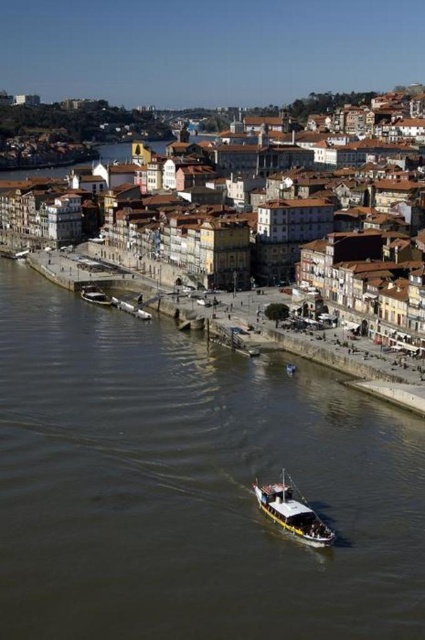
Question: Can you confirm if brown textured buildings at center is bigger than metallic silver boat at lower left?

Choices:
 (A) no
 (B) yes

Answer: (B)

Question: Does brown textured buildings at center have a smaller size compared to white matte boat at center?

Choices:
 (A) yes
 (B) no

Answer: (B)

Question: Among these points, which one is nearest to the camera?

Choices:
 (A) 314,525
 (B) 235,420
 (C) 87,294
 (D) 297,262

Answer: (A)

Question: Estimate the real-world distances between objects in this image. Which object is farther from the brown water at center?

Choices:
 (A) brown textured buildings at center
 (B) metallic silver boat at lower left

Answer: (A)

Question: Which point is farther to the camera?

Choices:
 (A) brown textured buildings at center
 (B) metallic silver boat at lower left
 (C) brown water at center

Answer: (B)

Question: Does brown textured buildings at center appear under white matte boat at center?

Choices:
 (A) yes
 (B) no

Answer: (B)